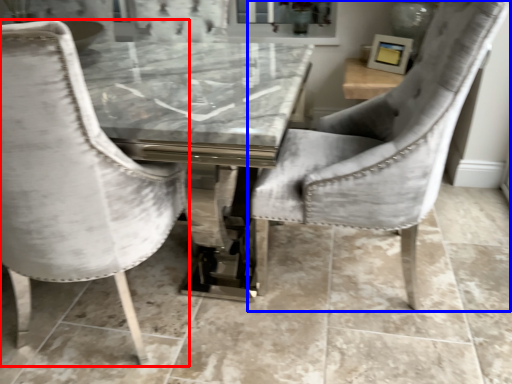
Question: Which point is further to the camera, chair (highlighted by a red box) or chair (highlighted by a blue box)?

Choices:
 (A) chair
 (B) chair

Answer: (B)